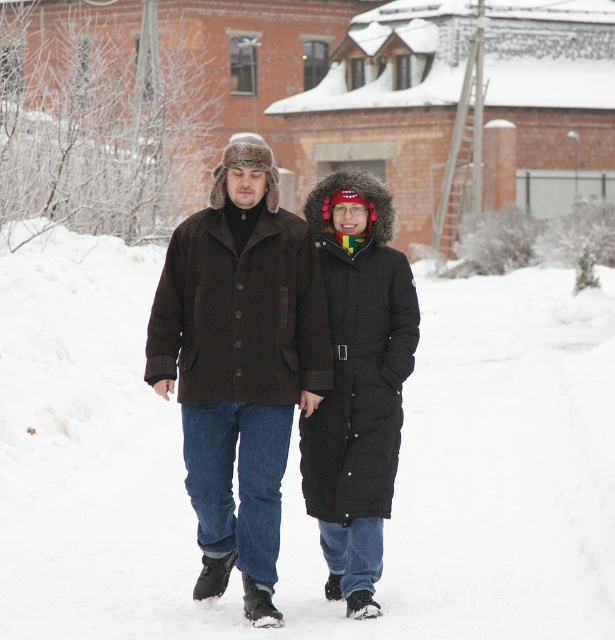
Identify the location of dark brown wool coat at center. Image resolution: width=615 pixels, height=640 pixels. (239, 362).

Who is taller, dark brown wool coat at center or black down jacket at center?

black down jacket at center

Does point (255, 140) come behind point (383, 333)?

That is False.

In order to click on dark brown wool coat at center in this screenshot , I will do click(x=239, y=362).

How much distance is there between white fluffy snow at center and black down jacket at center?

A distance of 3.71 meters exists between white fluffy snow at center and black down jacket at center.

Between white fluffy snow at center and black down jacket at center, which one is positioned lower?

Positioned lower is black down jacket at center.

What are the coordinates of `white fluffy snow at center` in the screenshot? It's located at click(298, 465).

Does white fluffy snow at center appear on the left side of dark brown wool coat at center?

No, white fluffy snow at center is not to the left of dark brown wool coat at center.

This screenshot has height=640, width=615. Describe the element at coordinates (298, 465) in the screenshot. I see `white fluffy snow at center` at that location.

Is point (539, 611) farther from camera compared to point (212, 472)?

No, (539, 611) is in front of (212, 472).

What are the coordinates of `white fluffy snow at center` in the screenshot? It's located at (298, 465).